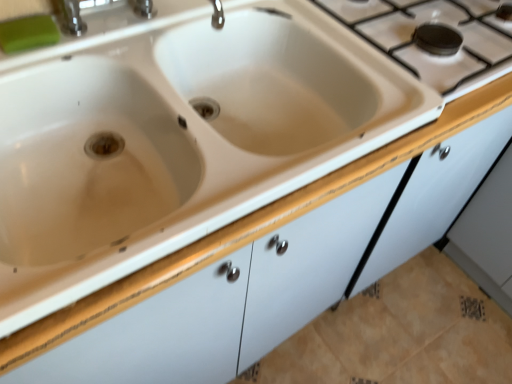
Image resolution: width=512 pixels, height=384 pixels. I want to click on white ceramic gas stove at upper right, so click(x=425, y=52).

From the picture: Considering the relative sizes of white ceramic sink at center and green rubber soap at upper left in the image provided, is white ceramic sink at center thinner than green rubber soap at upper left?

In fact, white ceramic sink at center might be wider than green rubber soap at upper left.

Does white ceramic sink at center appear on the right side of green rubber soap at upper left?

Yes.

From a real-world perspective, who is located lower, white ceramic sink at center or green rubber soap at upper left?

white ceramic sink at center, from a real-world perspective.

From the image's perspective, is white ceramic sink at center on green rubber soap at upper left?

Actually, white ceramic sink at center appears below green rubber soap at upper left in the image.

Considering the positions of objects green rubber soap at upper left and white ceramic gas stove at upper right in the image provided, who is more to the left, green rubber soap at upper left or white ceramic gas stove at upper right?

Positioned to the left is green rubber soap at upper left.

Which of these two, green rubber soap at upper left or white ceramic gas stove at upper right, is wider?

white ceramic gas stove at upper right.

From the image's perspective, is green rubber soap at upper left above white ceramic gas stove at upper right?

No, from the image's perspective, green rubber soap at upper left is not on top of white ceramic gas stove at upper right.

How many degrees apart are the facing directions of green rubber soap at upper left and white ceramic gas stove at upper right?

The angular difference between green rubber soap at upper left and white ceramic gas stove at upper right is 1.22 degrees.

Is white ceramic sink at center inside or outside of white ceramic gas stove at upper right?

white ceramic sink at center is outside white ceramic gas stove at upper right.

Considering the relative sizes of white ceramic sink at center and white ceramic gas stove at upper right in the image provided, is white ceramic sink at center bigger than white ceramic gas stove at upper right?

Correct, white ceramic sink at center is larger in size than white ceramic gas stove at upper right.

From the image's perspective, is white ceramic sink at center under white ceramic gas stove at upper right?

Yes.

Who is taller, white ceramic sink at center or white ceramic gas stove at upper right?

white ceramic sink at center is taller.

In the image, is white ceramic gas stove at upper right positioned in front of or behind green rubber soap at upper left?

Visually, white ceramic gas stove at upper right is located behind green rubber soap at upper left.

From a real-world perspective, between white ceramic gas stove at upper right and green rubber soap at upper left, who is vertically higher?

From a 3D spatial view, green rubber soap at upper left is above.

Considering the sizes of white ceramic gas stove at upper right and green rubber soap at upper left in the image, is white ceramic gas stove at upper right taller or shorter than green rubber soap at upper left?

Clearly, white ceramic gas stove at upper right is taller compared to green rubber soap at upper left.

You are a GUI agent. You are given a task and a screenshot of the screen. Output one action in this format:
    pyautogui.click(x=<x>, y=<y>)
    Task: Click on the soap behind the white ceramic sink at center
    This screenshot has height=384, width=512.
    Given the screenshot: What is the action you would take?
    pyautogui.click(x=28, y=33)

Is green rubber soap at upper left touching white ceramic sink at center?

No.

Between green rubber soap at upper left and white ceramic sink at center, which one has smaller size?

Smaller between the two is green rubber soap at upper left.

How different are the orientations of green rubber soap at upper left and white ceramic sink at center in degrees?

They differ by 1.22 degrees in their facing directions.

Can you see white ceramic gas stove at upper right touching white ceramic sink at center?

No, white ceramic gas stove at upper right is not making contact with white ceramic sink at center.

Considering the sizes of objects white ceramic gas stove at upper right and white ceramic sink at center in the image provided, who is shorter, white ceramic gas stove at upper right or white ceramic sink at center?

With less height is white ceramic gas stove at upper right.

Looking at this image, is white ceramic gas stove at upper right turned away from white ceramic sink at center?

No, white ceramic gas stove at upper right is not facing away from white ceramic sink at center.

Which is behind, point (460, 13) or point (242, 29)?

The point (460, 13) is more distant.

Locate an element on the screen. The image size is (512, 384). sink on the right of green rubber soap at upper left is located at coordinates (174, 135).

At what (x,y) coordinates should I click in order to perform the action: click on gas stove directly beneath the green rubber soap at upper left (from a real-world perspective). Please return your answer as a coordinate pair (x, y). The image size is (512, 384). Looking at the image, I should click on (425, 52).

Considering their positions, is green rubber soap at upper left positioned closer to white ceramic gas stove at upper right than white ceramic sink at center?

Based on the image, white ceramic sink at center appears to be nearer to white ceramic gas stove at upper right.

From the image, which object appears to be nearer to green rubber soap at upper left, white ceramic sink at center or white ceramic gas stove at upper right?

white ceramic sink at center is positioned closer to the anchor green rubber soap at upper left.

Estimate the real-world distances between objects in this image. Which object is further from white ceramic sink at center, green rubber soap at upper left or white ceramic gas stove at upper right?

white ceramic gas stove at upper right lies further to white ceramic sink at center than the other object.

Considering their positions, is white ceramic sink at center positioned further to white ceramic gas stove at upper right than green rubber soap at upper left?

green rubber soap at upper left is positioned further to the anchor white ceramic gas stove at upper right.

Estimate the real-world distances between objects in this image. Which object is further from green rubber soap at upper left, white ceramic gas stove at upper right or white ceramic sink at center?

The object further to green rubber soap at upper left is white ceramic gas stove at upper right.

When comparing their distances from white ceramic sink at center, does white ceramic gas stove at upper right or green rubber soap at upper left seem further?

white ceramic gas stove at upper right is further to white ceramic sink at center.

The height and width of the screenshot is (384, 512). Find the location of `sink situated between green rubber soap at upper left and white ceramic gas stove at upper right from left to right`. sink situated between green rubber soap at upper left and white ceramic gas stove at upper right from left to right is located at coordinates (174, 135).